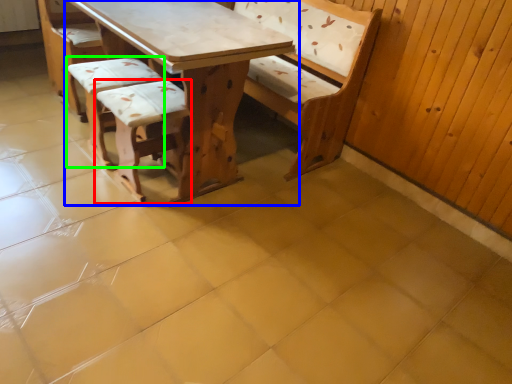
Question: Which object is the farthest from armchair (highlighted by a red box)? Choose among these: table (highlighted by a blue box) or armchair (highlighted by a green box).

Choices:
 (A) table
 (B) armchair

Answer: (B)